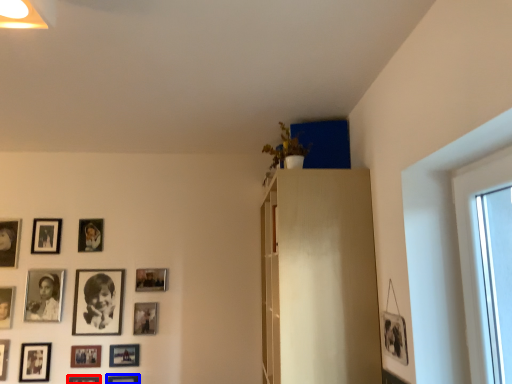
Question: Which object appears farthest to the camera in this image, picture frame (highlighted by a red box) or picture frame (highlighted by a blue box)?

Choices:
 (A) picture frame
 (B) picture frame

Answer: (B)